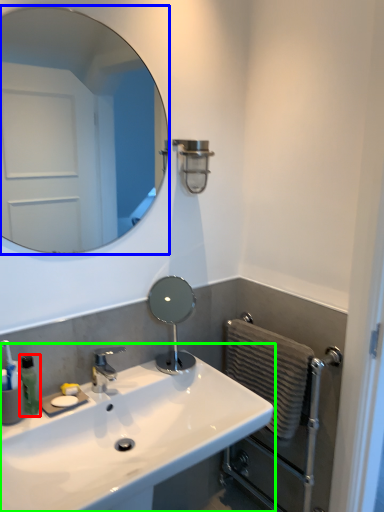
Question: Which is farther away from soap dispenser (highlighted by a red box)? mirror (highlighted by a blue box) or sink (highlighted by a green box)?

Choices:
 (A) mirror
 (B) sink

Answer: (A)